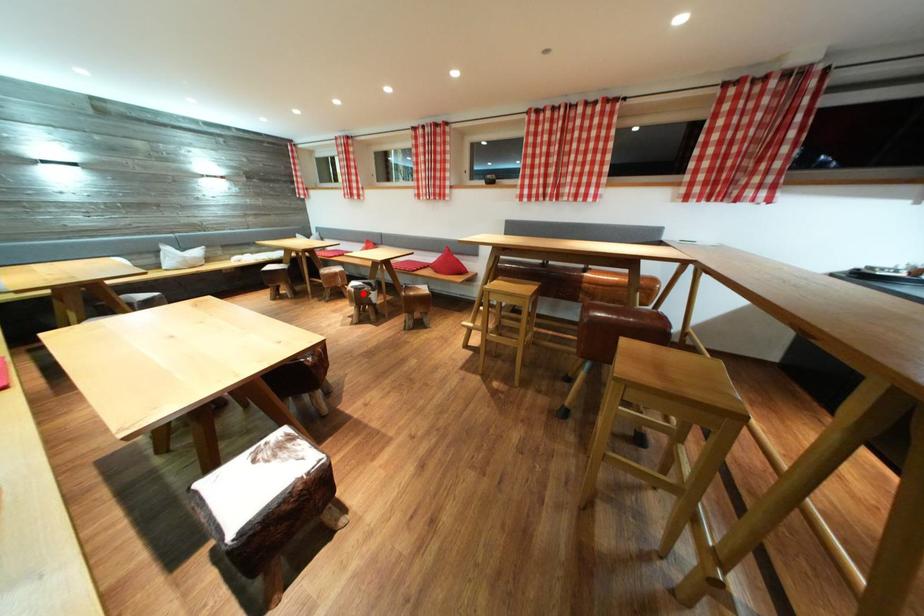
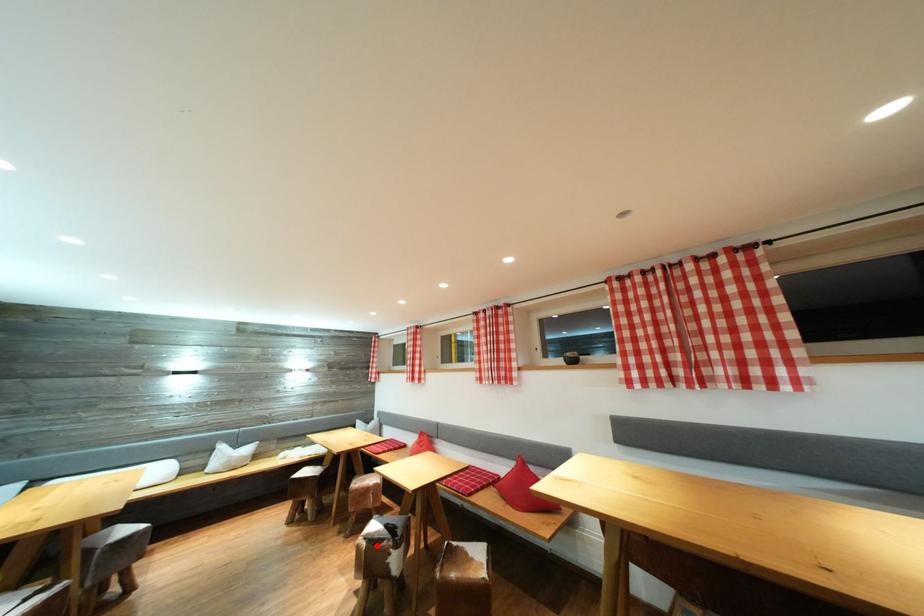
I am providing you with two images of the same scene from different viewpoints. A red point is marked on the first image and another point is marked on the second image. Does the point marked in image1 correspond to the same location as the one in image2?

Yes